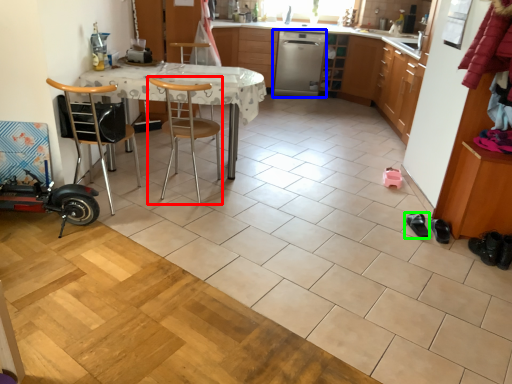
Question: Which object is the farthest from chair (highlighted by a red box)? Choose among these: dish washer (highlighted by a blue box) or footwear (highlighted by a green box).

Choices:
 (A) dish washer
 (B) footwear

Answer: (A)